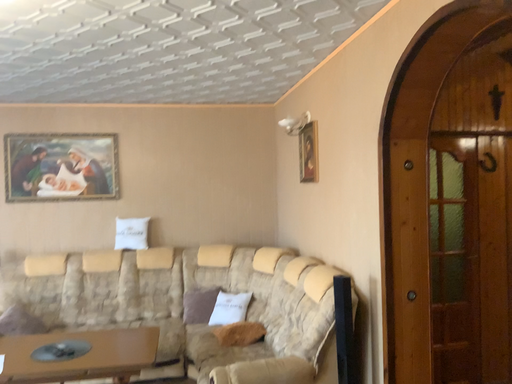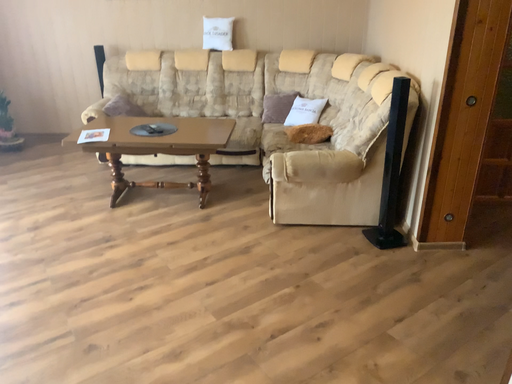
Question: Which way did the camera rotate in the video?

Choices:
 (A) rotated left
 (B) rotated right

Answer: (A)